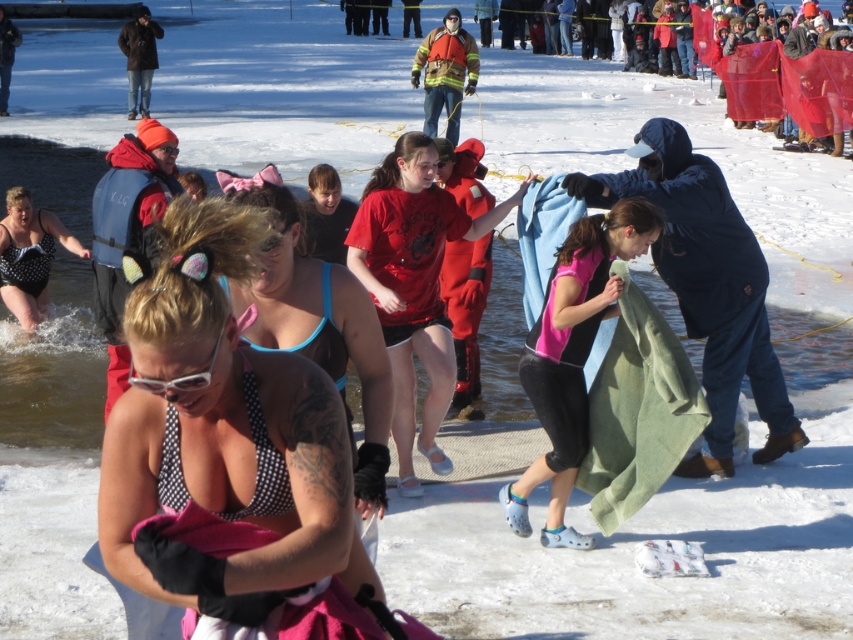
You are a photographer at the winter event. You see the blue bikini top at center and the dark brown leather jacket at upper left. Which item is positioned lower in the image?

The blue bikini top at center is located below the dark brown leather jacket at upper left, so it is positioned lower in the image.

Based on the photo, you are a photographer at the polar plunge event. You want to take a photo that includes both the blue bikini top at center and the dark brown leather jacket at upper left. Which object should you focus on first to ensure both are in frame?

The blue bikini top at center is much taller than the dark brown leather jacket at upper left, so you should focus on the blue bikini top at center first to ensure both are in frame.